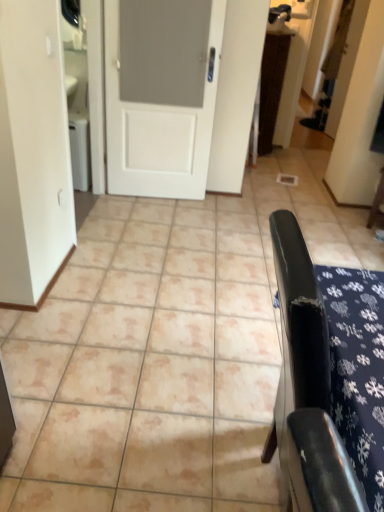
Question: Can you confirm if black leather chair at right, the second furniture from the top, is shorter than wooden chair at right, which appears as the second furniture when viewed from the left?

Choices:
 (A) yes
 (B) no

Answer: (B)

Question: Considering the relative sizes of black leather chair at right, which appears as the 2th furniture when viewed from the back, and wooden chair at right, the second furniture in the front-to-back sequence, in the image provided, is black leather chair at right, which appears as the 2th furniture when viewed from the back, bigger than wooden chair at right, the second furniture in the front-to-back sequence,?

Choices:
 (A) no
 (B) yes

Answer: (B)

Question: From the image's perspective, is black leather chair at right, acting as the 2th furniture starting from the right, located beneath wooden chair at right, which appears as the second furniture when viewed from the left?

Choices:
 (A) yes
 (B) no

Answer: (A)

Question: Is black leather chair at right, the 1th furniture positioned from the front, to the left of wooden chair at right, positioned as the 1th furniture in top-to-bottom order, from the viewer's perspective?

Choices:
 (A) yes
 (B) no

Answer: (A)

Question: Is black leather chair at right, the first furniture when ordered from bottom to top, looking in the opposite direction of wooden chair at right, which appears as the second furniture when viewed from the left?

Choices:
 (A) yes
 (B) no

Answer: (B)

Question: From their relative heights in the image, would you say black leather chair at right, which appears as the 2th furniture when viewed from the back, is taller or shorter than brown textured rug at upper center?

Choices:
 (A) tall
 (B) short

Answer: (B)

Question: Is point (350, 495) closer or farther from the camera than point (259, 148)?

Choices:
 (A) closer
 (B) farther

Answer: (A)

Question: From a real-world perspective, is black leather chair at right, the 1th furniture positioned from the front, positioned above or below brown textured rug at upper center?

Choices:
 (A) below
 (B) above

Answer: (A)

Question: Is black leather chair at right, the first furniture when ordered from bottom to top, inside the boundaries of brown textured rug at upper center, or outside?

Choices:
 (A) inside
 (B) outside

Answer: (B)

Question: From a real-world perspective, is black leather chair at right, the 1th furniture positioned from the front, positioned above or below wooden chair at right, which appears as the second furniture when viewed from the left?

Choices:
 (A) above
 (B) below

Answer: (A)

Question: Is black leather chair at right, acting as the 2th furniture starting from the right, spatially inside wooden chair at right, the 1th furniture from the back, or outside of it?

Choices:
 (A) outside
 (B) inside

Answer: (A)

Question: From the image's perspective, is black leather chair at right, acting as the 2th furniture starting from the right, located above or below wooden chair at right, positioned as the 1th furniture in top-to-bottom order?

Choices:
 (A) above
 (B) below

Answer: (B)

Question: In the image, is black leather chair at right, the second furniture from the top, on the left side or the right side of wooden chair at right, which is counted as the 1th furniture, starting from the right?

Choices:
 (A) left
 (B) right

Answer: (A)

Question: Is beige ceramic tile at center in front of or behind black leather chair at right, positioned as the 1th furniture in left-to-right order, in the image?

Choices:
 (A) front
 (B) behind

Answer: (B)

Question: In terms of height, does beige ceramic tile at center look taller or shorter compared to black leather chair at right, the first furniture when ordered from bottom to top?

Choices:
 (A) tall
 (B) short

Answer: (B)